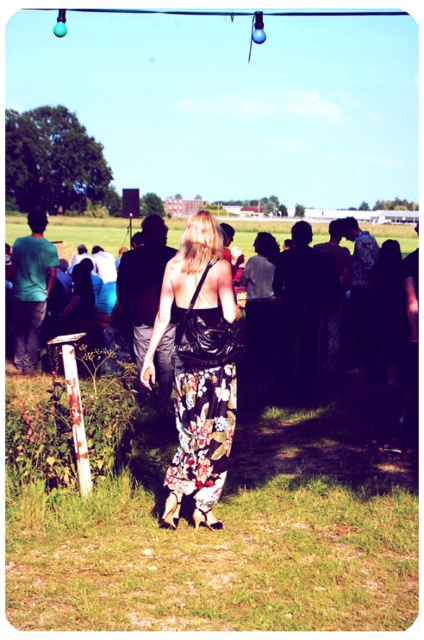
Question: Which of these objects is positioned closest to the leather sandal at lower center?

Choices:
 (A) floral fabric dress at center
 (B) white fabric sandal at lower center
 (C) floral-patterned fabric dress at center

Answer: (B)

Question: Where is floral-patterned fabric dress at center located in relation to leather sandal at lower center in the image?

Choices:
 (A) left
 (B) right

Answer: (B)

Question: Is floral-patterned fabric dress at center smaller than leather sandal at lower center?

Choices:
 (A) yes
 (B) no

Answer: (B)

Question: Where is floral-patterned fabric dress at center located in relation to leather sandal at lower center in the image?

Choices:
 (A) left
 (B) right

Answer: (B)

Question: Which point is closer to the camera?

Choices:
 (A) (195, 472)
 (B) (214, 522)
 (C) (172, 499)
 (D) (379, 328)

Answer: (B)

Question: Which object is positioned closest to the floral fabric dress at center?

Choices:
 (A) leather sandal at lower center
 (B) floral-patterned fabric dress at center
 (C) white fabric sandal at lower center

Answer: (B)